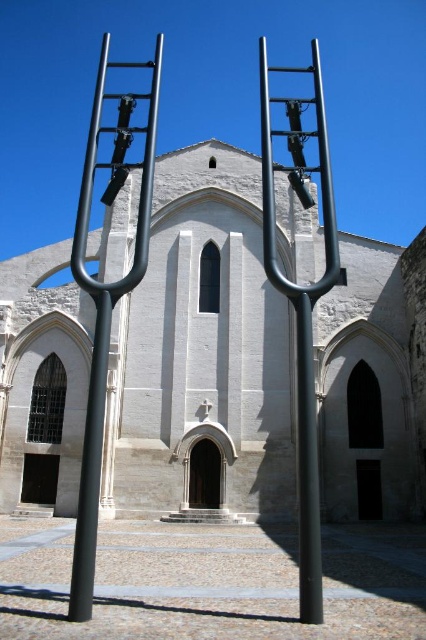
Does polished metal ladder at center appear on the left side of metallic black ladder at center?

Correct, you'll find polished metal ladder at center to the left of metallic black ladder at center.

Between point (115, 67) and point (307, 588), which one is positioned in front?

Point (307, 588) is more forward.

Describe the element at coordinates (106, 300) in the screenshot. This screenshot has height=640, width=426. I see `polished metal ladder at center` at that location.

What are the coordinates of `polished metal ladder at center` in the screenshot? It's located at pos(106,300).

Who is higher up, metallic black ladder at center or black matte pole at center?

metallic black ladder at center

Can you confirm if metallic black ladder at center is positioned above black matte pole at center?

Yes, metallic black ladder at center is above black matte pole at center.

Which is in front, point (264, 81) or point (305, 474)?

Point (305, 474) is more forward.

Identify the location of metallic black ladder at center. The height and width of the screenshot is (640, 426). (301, 304).

In the scene shown: Which is more to the left, white stone church at center or metallic black ladder at center?

white stone church at center

Between point (54, 266) and point (307, 288), which one is positioned behind?

The point (54, 266) is behind.

Find the location of `white stone church at center`. white stone church at center is located at coordinates (201, 349).

You are a GUI agent. You are given a task and a screenshot of the screen. Output one action in this format:
    pyautogui.click(x=<x>, y=<y>)
    Task: Click on the white stone church at center
    
    Given the screenshot: What is the action you would take?
    pyautogui.click(x=201, y=349)